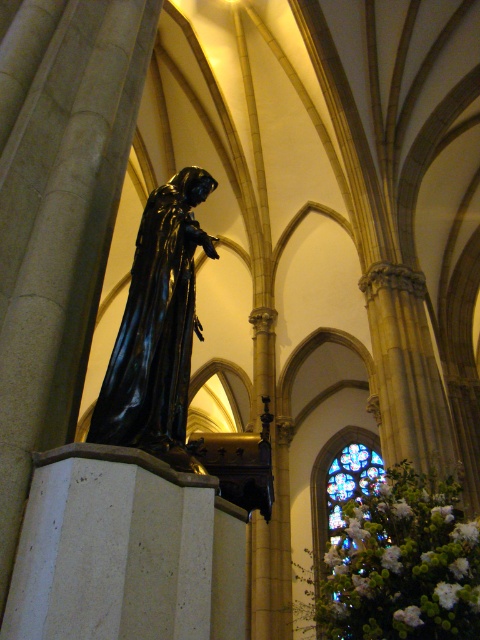
Does shiny black statue at center lie behind stained glass window at center?

No, it is not.

Is the position of shiny black statue at center less distant than that of stained glass window at center?

That is True.

Does point (172, 301) come behind point (321, 544)?

No, (172, 301) is closer to viewer.

What are the coordinates of `shiny black statue at center` in the screenshot? It's located at (157, 328).